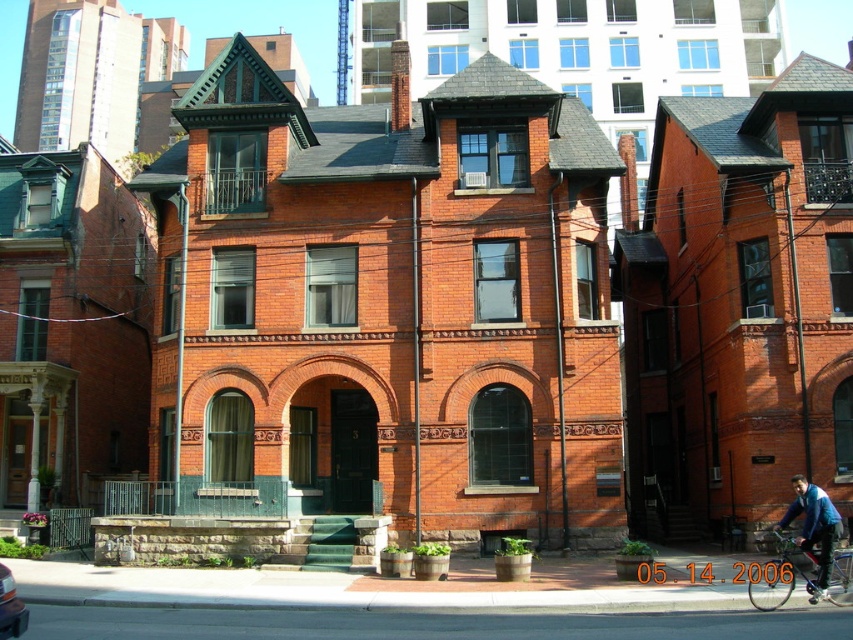
You are standing at the entrance of the historic brick building and want to locate two specific points marked on the facade. The first point is at coordinates point(827, 532) and the second is at point(3, 612). Which of these two points is closer to the entrance?

Point(3, 612) is closer to the entrance because it is in front of point(827, 532).

You are a delivery person approaching the historic brick building and see both the metallic blue bicycle at lower right and the blue denim jacket at lower right. Which object is closer to you as you stand at the entrance?

The metallic blue bicycle at lower right is closer to you because it is further to the viewer than the blue denim jacket at lower right.

Consider the image. You are a delivery person standing at the front door of the historic brick building. You need to place a package on the blue denim jacket at lower right and then drive the metallic silver car at lower left to the post office. Can you complete both tasks without moving more than 20 meters from the front door?

The blue denim jacket at lower right and metallic silver car at lower left are 19.42 meters apart. Since the total distance required to complete both tasks is within the 20 meters limit, you can complete both tasks without exceeding the distance restriction.